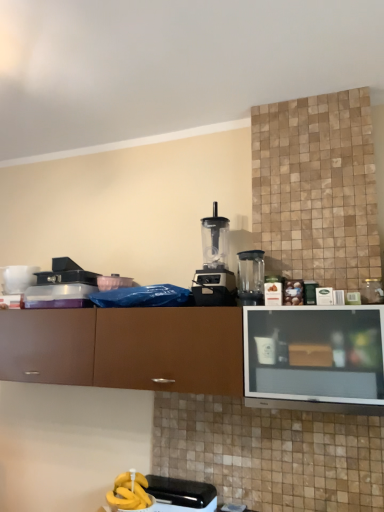
Image resolution: width=384 pixels, height=512 pixels. What do you see at coordinates (178, 492) in the screenshot?
I see `black plastic toaster at lower center, the 1th appliance in the front-to-back sequence` at bounding box center [178, 492].

This screenshot has height=512, width=384. Find the location of `brown matte cabinet at center`. brown matte cabinet at center is located at coordinates (126, 348).

Locate an element on the screen. This screenshot has height=512, width=384. black plastic blender at center, which ranks as the 2th kitchen appliance in right-to-left order is located at coordinates [x=214, y=265].

Where is `black plastic toaster at lower center, which is counted as the 2th appliance, starting from the back`? This screenshot has width=384, height=512. black plastic toaster at lower center, which is counted as the 2th appliance, starting from the back is located at coordinates (178, 492).

In order to click on cabinetry on the right of white glossy mug at upper left, the 1th appliance positioned from the left in this screenshot , I will do `click(126, 348)`.

Is brown matte cabinet at center inside the boundaries of white glossy mug at upper left, which is the 2th appliance in right-to-left order, or outside?

brown matte cabinet at center is spatially situated outside white glossy mug at upper left, which is the 2th appliance in right-to-left order.

From the picture: Measure the distance from brown matte cabinet at center to white glossy mug at upper left, acting as the 1th appliance starting from the back.

brown matte cabinet at center and white glossy mug at upper left, acting as the 1th appliance starting from the back, are 24.42 inches apart from each other.

From the image's perspective, is brown matte cabinet at center located above white glossy mug at upper left, acting as the 1th appliance starting from the back?

Actually, brown matte cabinet at center appears below white glossy mug at upper left, acting as the 1th appliance starting from the back, in the image.

From the picture: Could you tell me if brown matte cabinet at center is facing black plastic toaster at lower center, the 1th appliance in the front-to-back sequence?

No, brown matte cabinet at center is not oriented towards black plastic toaster at lower center, the 1th appliance in the front-to-back sequence.

From a real-world perspective, who is located higher, brown matte cabinet at center or black plastic toaster at lower center, the 1th appliance in the front-to-back sequence?

brown matte cabinet at center.

Measure the distance between brown matte cabinet at center and black plastic toaster at lower center, marked as the second appliance in a top-to-bottom arrangement.

brown matte cabinet at center is 25.21 inches from black plastic toaster at lower center, marked as the second appliance in a top-to-bottom arrangement.

Can you confirm if brown matte cabinet at center is thinner than black plastic toaster at lower center, which is counted as the 2th appliance, starting from the back?

Incorrect, the width of brown matte cabinet at center is not less than that of black plastic toaster at lower center, which is counted as the 2th appliance, starting from the back.

Is transparent plastic blender at center, the first kitchen appliance when ordered from right to left, positioned beyond the bounds of black plastic toaster at lower center, placed as the 2th appliance when sorted from left to right?

That's correct, transparent plastic blender at center, the first kitchen appliance when ordered from right to left, is outside of black plastic toaster at lower center, placed as the 2th appliance when sorted from left to right.

Is transparent plastic blender at center, the first kitchen appliance when ordered from right to left, looking in the opposite direction of black plastic toaster at lower center, positioned as the 1th appliance in bottom-to-top order?

transparent plastic blender at center, the first kitchen appliance when ordered from right to left, does not have its back to black plastic toaster at lower center, positioned as the 1th appliance in bottom-to-top order.

Considering the positions of objects transparent plastic blender at center, which is counted as the second kitchen appliance, starting from the left, and black plastic toaster at lower center, the 1th appliance in the front-to-back sequence, in the image provided, who is more to the left, transparent plastic blender at center, which is counted as the second kitchen appliance, starting from the left, or black plastic toaster at lower center, the 1th appliance in the front-to-back sequence,?

Positioned to the left is black plastic toaster at lower center, the 1th appliance in the front-to-back sequence.

Is the position of transparent plastic blender at center, the first kitchen appliance when ordered from right to left, more distant than that of black plastic toaster at lower center, marked as the second appliance in a top-to-bottom arrangement?

Yes, the depth of transparent plastic blender at center, the first kitchen appliance when ordered from right to left, is greater than that of black plastic toaster at lower center, marked as the second appliance in a top-to-bottom arrangement.

Is black plastic blender at center, the 1th kitchen appliance in the left-to-right sequence, to the right of transparent plastic blender at center, which is counted as the second kitchen appliance, starting from the left, from the viewer's perspective?

Incorrect, black plastic blender at center, the 1th kitchen appliance in the left-to-right sequence, is not on the right side of transparent plastic blender at center, which is counted as the second kitchen appliance, starting from the left.

Is black plastic blender at center, the 1th kitchen appliance in the left-to-right sequence, not within transparent plastic blender at center, which is counted as the second kitchen appliance, starting from the left?

Yes, black plastic blender at center, the 1th kitchen appliance in the left-to-right sequence, is not within transparent plastic blender at center, which is counted as the second kitchen appliance, starting from the left.

Which object is closer to the camera, black plastic blender at center, which ranks as the 2th kitchen appliance in right-to-left order, or transparent plastic blender at center, which is counted as the second kitchen appliance, starting from the left?

transparent plastic blender at center, which is counted as the second kitchen appliance, starting from the left.

In the image, there is a transparent plastic blender at center, the first kitchen appliance when ordered from right to left. Where is `kitchen appliance above it (from the image's perspective)`? Image resolution: width=384 pixels, height=512 pixels. kitchen appliance above it (from the image's perspective) is located at coordinates (214, 265).

Is point (113, 492) behind point (16, 271)?

No, it is not.

Looking at this image, could you tell me if black plastic toaster at lower center, the 1th appliance in the front-to-back sequence, is facing white glossy mug at upper left, the 1th appliance positioned from the left?

No, black plastic toaster at lower center, the 1th appliance in the front-to-back sequence, is not facing towards white glossy mug at upper left, the 1th appliance positioned from the left.

Can you confirm if black plastic toaster at lower center, positioned as the 1th appliance in bottom-to-top order, is smaller than white glossy mug at upper left, the 1th appliance positioned from the left?

Actually, black plastic toaster at lower center, positioned as the 1th appliance in bottom-to-top order, might be larger than white glossy mug at upper left, the 1th appliance positioned from the left.

From a real-world perspective, is black plastic toaster at lower center, which is counted as the 2th appliance, starting from the back, over white glossy mug at upper left, marked as the 1th appliance in a top-to-bottom arrangement?

Actually, black plastic toaster at lower center, which is counted as the 2th appliance, starting from the back, is physically below white glossy mug at upper left, marked as the 1th appliance in a top-to-bottom arrangement, in the real world.

From a real-world perspective, does black plastic blender at center, the 1th kitchen appliance in the left-to-right sequence, stand above black plastic toaster at lower center, which is counted as the 2th appliance, starting from the back?

Yes, from a real-world perspective, black plastic blender at center, the 1th kitchen appliance in the left-to-right sequence, is over black plastic toaster at lower center, which is counted as the 2th appliance, starting from the back

Considering the sizes of black plastic blender at center, the 1th kitchen appliance in the left-to-right sequence, and black plastic toaster at lower center, the 1th appliance in the front-to-back sequence, in the image, is black plastic blender at center, the 1th kitchen appliance in the left-to-right sequence, wider or thinner than black plastic toaster at lower center, the 1th appliance in the front-to-back sequence,?

In the image, black plastic blender at center, the 1th kitchen appliance in the left-to-right sequence, appears to be wider than black plastic toaster at lower center, the 1th appliance in the front-to-back sequence.

Would you say black plastic blender at center, which ranks as the 2th kitchen appliance in right-to-left order, is a long distance from black plastic toaster at lower center, the 1th appliance positioned from the right?

No.

Which object is more forward, black plastic blender at center, the 1th kitchen appliance in the left-to-right sequence, or black plastic toaster at lower center, marked as the second appliance in a top-to-bottom arrangement?

black plastic toaster at lower center, marked as the second appliance in a top-to-bottom arrangement, is more forward.

Locate an element on the screen. The image size is (384, 512). kitchen appliance that appears above the white glossy mug at upper left, marked as the 1th appliance in a top-to-bottom arrangement (from a real-world perspective) is located at coordinates (214, 265).

Relative to black plastic blender at center, the 1th kitchen appliance in the left-to-right sequence, is white glossy mug at upper left, which is counted as the 2th appliance, starting from the front, in front or behind?

white glossy mug at upper left, which is counted as the 2th appliance, starting from the front, is positioned farther from the viewer than black plastic blender at center, the 1th kitchen appliance in the left-to-right sequence.

Which point is more forward, (5, 271) or (197, 281)?

Point (197, 281)

In the image, there is a white glossy mug at upper left, marked as the 1th appliance in a top-to-bottom arrangement. At what (x,y) coordinates should I click in order to perform the action: click on cabinetry below it (from the image's perspective). Please return your answer as a coordinate pair (x, y). Looking at the image, I should click on (126, 348).

Where is `appliance below the brown matte cabinet at center (from a real-world perspective)`? Image resolution: width=384 pixels, height=512 pixels. appliance below the brown matte cabinet at center (from a real-world perspective) is located at coordinates (178, 492).

From the image, which object appears to be farther from black plastic toaster at lower center, positioned as the 1th appliance in bottom-to-top order, transparent plastic blender at center, the first kitchen appliance when ordered from right to left, or white glossy mug at upper left, marked as the 1th appliance in a top-to-bottom arrangement?

The object further to black plastic toaster at lower center, positioned as the 1th appliance in bottom-to-top order, is white glossy mug at upper left, marked as the 1th appliance in a top-to-bottom arrangement.

Which object lies nearer to the anchor point black plastic blender at center, which ranks as the 2th kitchen appliance in right-to-left order, white glossy mug at upper left, the 1th appliance positioned from the left, or black plastic toaster at lower center, the 1th appliance in the front-to-back sequence?

The object closer to black plastic blender at center, which ranks as the 2th kitchen appliance in right-to-left order, is black plastic toaster at lower center, the 1th appliance in the front-to-back sequence.

Considering their positions, is transparent plastic blender at center, the first kitchen appliance when ordered from right to left, positioned further to black plastic toaster at lower center, placed as the 2th appliance when sorted from left to right, than black plastic blender at center, the 1th kitchen appliance in the left-to-right sequence?

Among the two, transparent plastic blender at center, the first kitchen appliance when ordered from right to left, is located further to black plastic toaster at lower center, placed as the 2th appliance when sorted from left to right.

Considering their positions, is brown matte cabinet at center positioned closer to black plastic toaster at lower center, positioned as the 1th appliance in bottom-to-top order, than black plastic blender at center, which ranks as the 2th kitchen appliance in right-to-left order?

Based on the image, brown matte cabinet at center appears to be nearer to black plastic toaster at lower center, positioned as the 1th appliance in bottom-to-top order.

Based on their spatial positions, is white glossy mug at upper left, the 1th appliance positioned from the left, or black plastic blender at center, which ranks as the 2th kitchen appliance in right-to-left order, further from transparent plastic blender at center, the first kitchen appliance when ordered from right to left?

white glossy mug at upper left, the 1th appliance positioned from the left, is further to transparent plastic blender at center, the first kitchen appliance when ordered from right to left.

Which object lies further to the anchor point black plastic toaster at lower center, placed as the 2th appliance when sorted from left to right, black plastic blender at center, the 1th kitchen appliance in the left-to-right sequence, or transparent plastic blender at center, which is counted as the second kitchen appliance, starting from the left?

transparent plastic blender at center, which is counted as the second kitchen appliance, starting from the left, is positioned further to the anchor black plastic toaster at lower center, placed as the 2th appliance when sorted from left to right.

From the image, which object appears to be farther from black plastic toaster at lower center, positioned as the 1th appliance in bottom-to-top order, brown matte cabinet at center or transparent plastic blender at center, which is counted as the second kitchen appliance, starting from the left?

Among the two, transparent plastic blender at center, which is counted as the second kitchen appliance, starting from the left, is located further to black plastic toaster at lower center, positioned as the 1th appliance in bottom-to-top order.

Looking at the image, which one is located further to brown matte cabinet at center, white glossy mug at upper left, marked as the 1th appliance in a top-to-bottom arrangement, or black plastic blender at center, the 1th kitchen appliance in the left-to-right sequence?

white glossy mug at upper left, marked as the 1th appliance in a top-to-bottom arrangement, is positioned further to the anchor brown matte cabinet at center.

At what (x,y) coordinates should I click in order to perform the action: click on cabinetry located between white glossy mug at upper left, the 2th appliance when ordered from bottom to top, and transparent plastic blender at center, which is counted as the second kitchen appliance, starting from the left, in the left-right direction. Please return your answer as a coordinate pair (x, y). This screenshot has width=384, height=512. Looking at the image, I should click on (126, 348).

Locate an element on the screen. The width and height of the screenshot is (384, 512). cabinetry between white glossy mug at upper left, the 1th appliance positioned from the left, and black plastic toaster at lower center, the 1th appliance in the front-to-back sequence, vertically is located at coordinates (126, 348).

Locate an element on the screen. The height and width of the screenshot is (512, 384). cabinetry between transparent plastic blender at center, the first kitchen appliance when ordered from right to left, and black plastic toaster at lower center, which is counted as the 2th appliance, starting from the back, in the up-down direction is located at coordinates point(126,348).

The height and width of the screenshot is (512, 384). In order to click on cabinetry between black plastic blender at center, which ranks as the 2th kitchen appliance in right-to-left order, and black plastic toaster at lower center, marked as the second appliance in a top-to-bottom arrangement, in the up-down direction in this screenshot , I will do `click(126, 348)`.